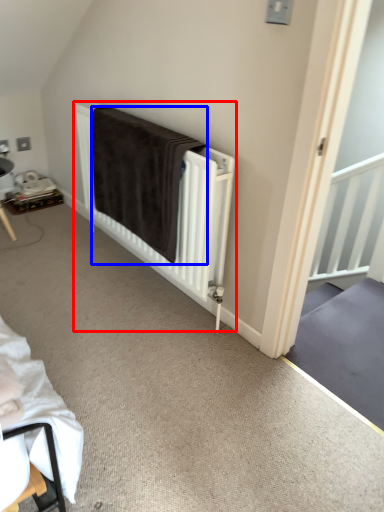
Question: Which object is further to the camera taking this photo, bed (highlighted by a red box) or blanket (highlighted by a blue box)?

Choices:
 (A) bed
 (B) blanket

Answer: (B)